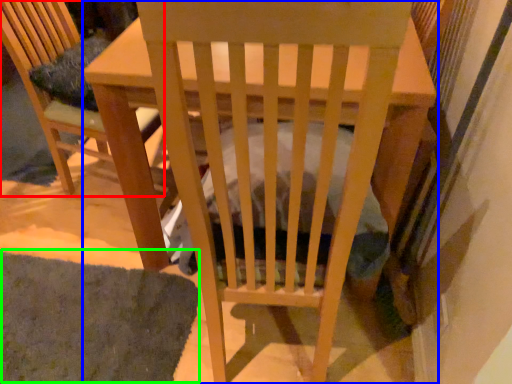
Question: Which object is positioned closest to chair (highlighted by a red box)? Select from table (highlighted by a blue box) and mat (highlighted by a green box).

Choices:
 (A) table
 (B) mat

Answer: (A)